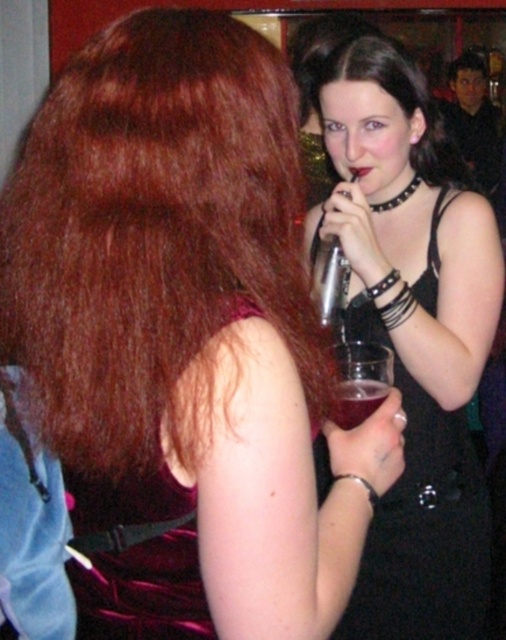
Measure the distance between point (x=86, y=612) and camera.

Point (x=86, y=612) is 28.85 inches away from camera.

Can you confirm if velvet purple dress at upper left is shorter than translucent plastic wine glass at upper right?

No.

Image resolution: width=506 pixels, height=640 pixels. Describe the element at coordinates (137, 557) in the screenshot. I see `velvet purple dress at upper left` at that location.

The height and width of the screenshot is (640, 506). What are the coordinates of `velvet purple dress at upper left` in the screenshot? It's located at (137, 557).

Does black leather dress at center come behind velvet purple dress at upper left?

Yes.

Who is more forward, (460, 492) or (122, 625)?

Point (122, 625) is in front.

You are a GUI agent. You are given a task and a screenshot of the screen. Output one action in this format:
    pyautogui.click(x=<x>, y=<y>)
    Task: Click on the black leather dress at center
    This screenshot has height=640, width=506.
    Given the screenshot: What is the action you would take?
    pyautogui.click(x=413, y=333)

Consider the image. Can you confirm if black leather dress at center is taller than translucent plastic wine glass at upper right?

Correct, black leather dress at center is much taller as translucent plastic wine glass at upper right.

The height and width of the screenshot is (640, 506). I want to click on black leather dress at center, so click(413, 333).